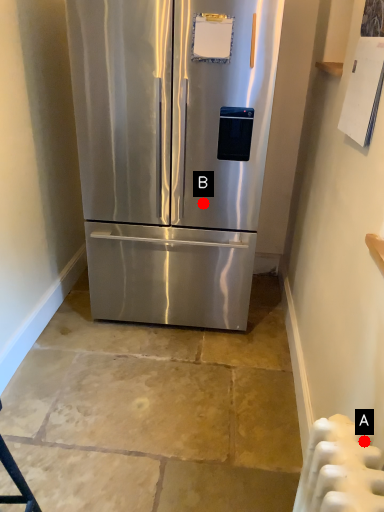
Question: Two points are circled on the image, labeled by A and B beside each circle. Which point appears closest to the camera in this image?

Choices:
 (A) A is closer
 (B) B is closer

Answer: (A)